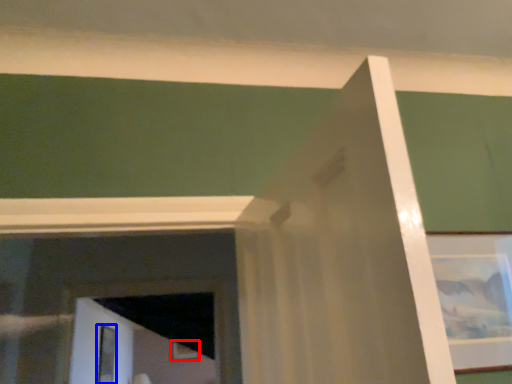
Question: Which of the following is the closest to the observer, picture frame (highlighted by a red box) or screen door (highlighted by a blue box)?

Choices:
 (A) picture frame
 (B) screen door

Answer: (B)